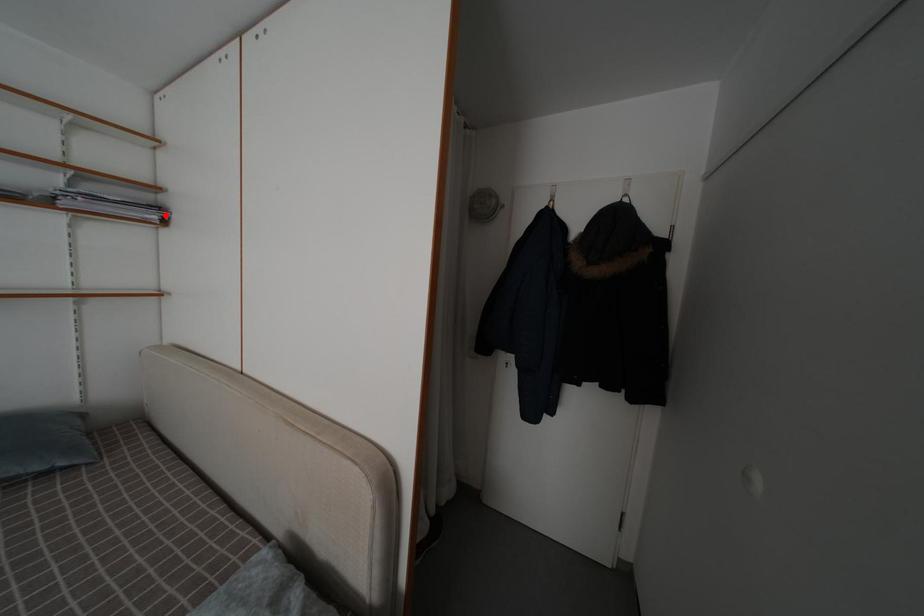
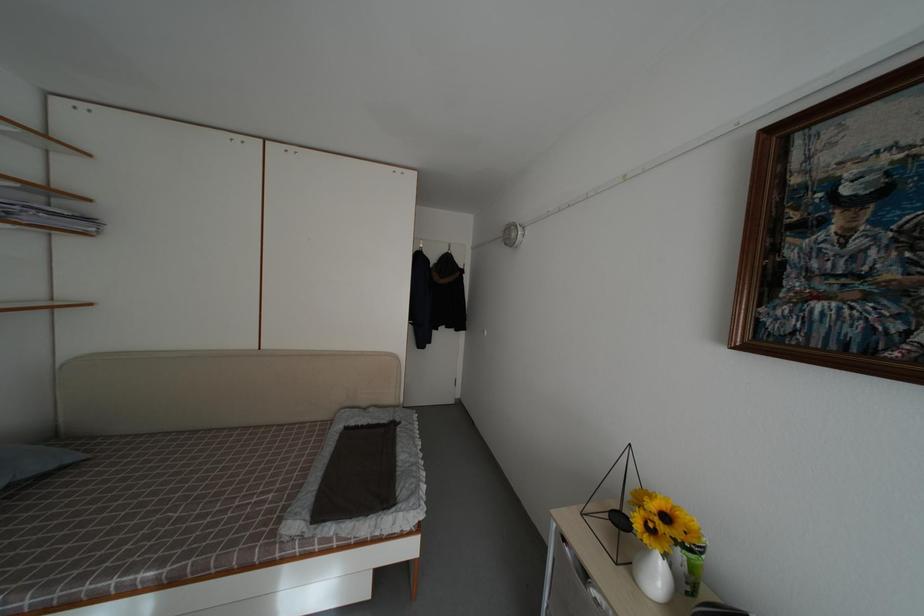
The point at the highlighted location is marked in the first image. Where is the corresponding point in the second image?

(94, 225)